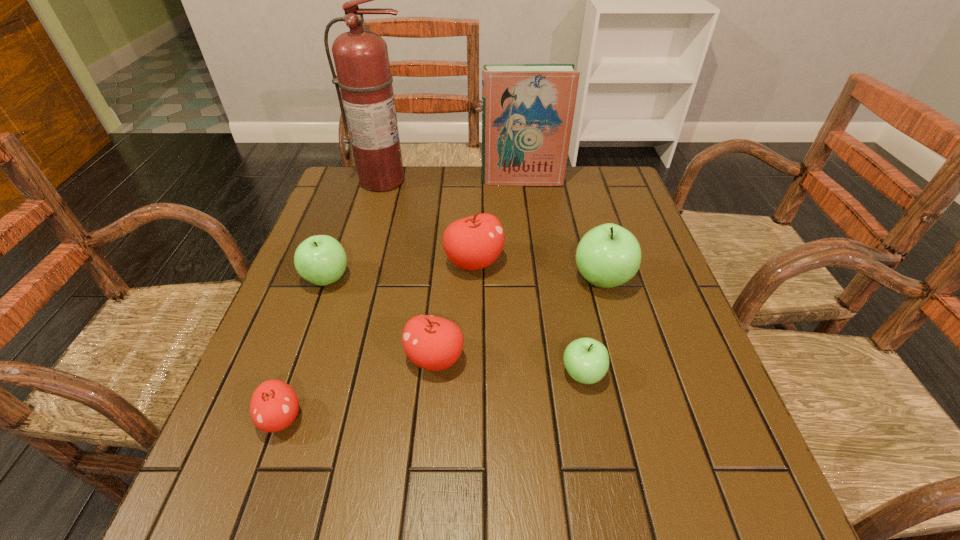
The height and width of the screenshot is (540, 960). Find the location of `vacant region between the tallest object and the smallest green apple`. vacant region between the tallest object and the smallest green apple is located at coordinates (483, 277).

The height and width of the screenshot is (540, 960). I want to click on free space between the smallest green apple and the second biggest red apple, so click(x=509, y=366).

What are the coordinates of `vacant area that lies between the second farthest red apple and the nearest object` in the screenshot? It's located at (358, 388).

The image size is (960, 540). Find the location of `free space between the seventh shortest object and the leftmost green apple`. free space between the seventh shortest object and the leftmost green apple is located at coordinates click(x=424, y=230).

You are a GUI agent. You are given a task and a screenshot of the screen. Output one action in this format:
    pyautogui.click(x=<x>, y=<y>)
    Task: Click on the vacant region between the second farthest red apple and the nearest red apple
    The image size is (960, 540).
    Given the screenshot: What is the action you would take?
    pyautogui.click(x=358, y=388)

The height and width of the screenshot is (540, 960). I want to click on free space between the second biggest red apple and the leftmost green apple, so click(x=381, y=319).

I want to click on vacant space that is in between the leftmost green apple and the farthest red apple, so click(x=400, y=271).

Locate an element on the screen. The image size is (960, 540). free point between the second nearest red apple and the leftmost green apple is located at coordinates (381, 319).

This screenshot has width=960, height=540. Find the location of `vacant space in between the second farthest red apple and the farthest red apple`. vacant space in between the second farthest red apple and the farthest red apple is located at coordinates (454, 310).

Identify which object is the second closest to the tallest object. Please provide its 2D coordinates. Your answer should be formatted as a tuple, i.e. [(x, y)], where the tuple contains the x and y coordinates of a point satisfying the conditions above.

[(472, 243)]